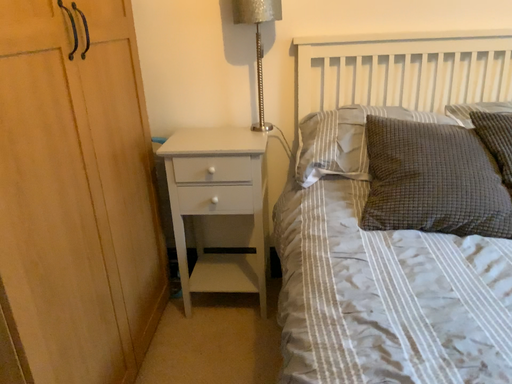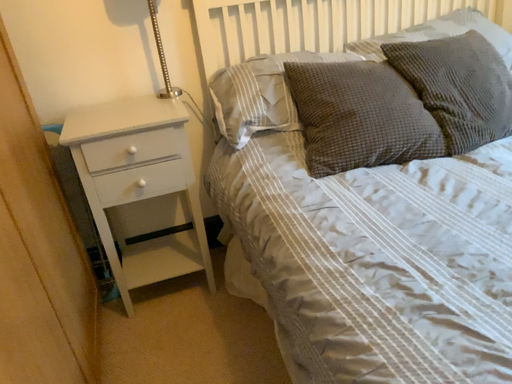
Question: Which way did the camera rotate in the video?

Choices:
 (A) rotated left
 (B) rotated right

Answer: (B)